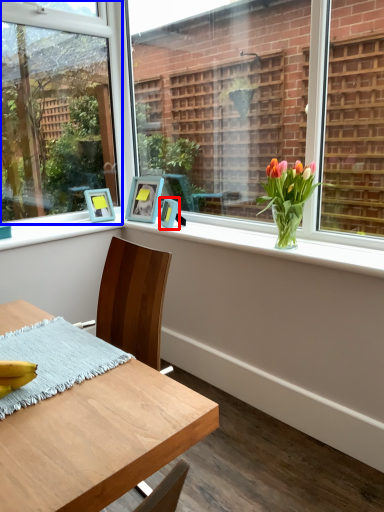
Question: Which object appears farthest to the camera in this image, picture frame (highlighted by a red box) or window (highlighted by a blue box)?

Choices:
 (A) picture frame
 (B) window

Answer: (A)